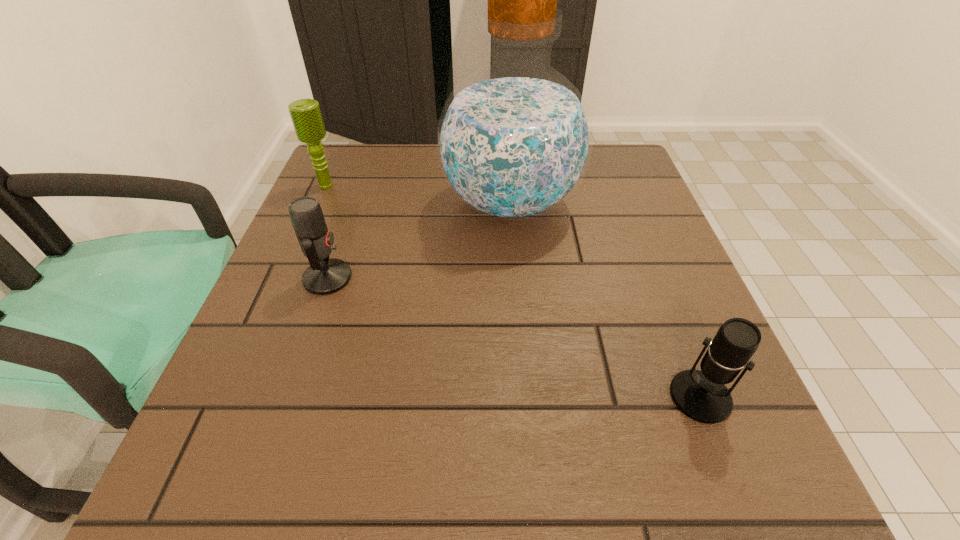
Identify the location of vacant space at the near right corner. (772, 480).

You are a GUI agent. You are given a task and a screenshot of the screen. Output one action in this format:
    pyautogui.click(x=<x>, y=<y>)
    Task: Click on the free spot between the third farthest object and the second object from right to left
    This screenshot has width=960, height=540.
    Given the screenshot: What is the action you would take?
    pyautogui.click(x=419, y=241)

Where is `vacant space that is in between the rightmost microphone and the third object from left to right`? This screenshot has width=960, height=540. vacant space that is in between the rightmost microphone and the third object from left to right is located at coordinates (606, 300).

Where is `vacant space that's between the nearest object and the leftmost object`? vacant space that's between the nearest object and the leftmost object is located at coordinates (514, 291).

Find the location of `vacant area that lies between the nearest microphone and the second object from right to left`. vacant area that lies between the nearest microphone and the second object from right to left is located at coordinates (606, 300).

Identify the location of blank region between the rightmost object and the second microphone from right to left. The width and height of the screenshot is (960, 540). (514, 338).

Image resolution: width=960 pixels, height=540 pixels. I want to click on free area in between the tallest object and the rightmost object, so click(606, 300).

At what (x,y) coordinates should I click in order to perform the action: click on free point between the tallest object and the third object from right to left. Please return your answer as a coordinate pair (x, y). The image size is (960, 540). Looking at the image, I should click on (419, 241).

The height and width of the screenshot is (540, 960). What are the coordinates of `free space between the leftmost object and the second object from right to left` in the screenshot? It's located at (419, 194).

The width and height of the screenshot is (960, 540). What are the coordinates of `the second closest object to the nearest microphone` in the screenshot? It's located at (324, 276).